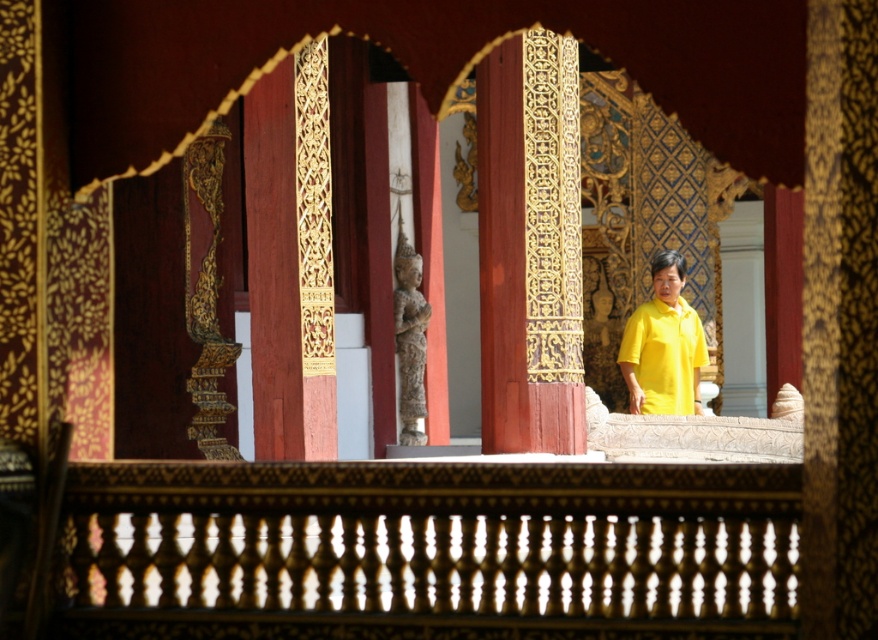
Question: Among these points, which one is farthest from the camera?

Choices:
 (A) (646, 403)
 (B) (632, 604)

Answer: (A)

Question: Can you confirm if wooden carved rail at center is wider than yellow matte shirt at center?

Choices:
 (A) yes
 (B) no

Answer: (B)

Question: Is wooden carved rail at center positioned behind yellow matte shirt at center?

Choices:
 (A) yes
 (B) no

Answer: (B)

Question: From the image, what is the correct spatial relationship of wooden carved rail at center in relation to yellow matte shirt at center?

Choices:
 (A) right
 (B) left

Answer: (B)